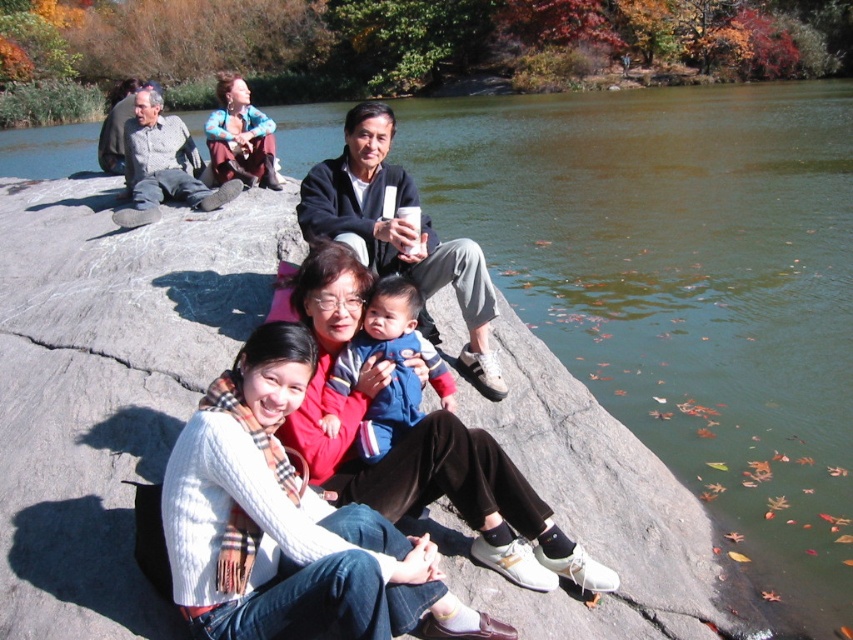
Question: Which object appears closest to the camera in this image?

Choices:
 (A) blue fleece jacket at center
 (B) white knit sweater at center
 (C) matte black jacket at center

Answer: (B)

Question: Does white knit sweater at center have a smaller size compared to matte black jacket at center?

Choices:
 (A) yes
 (B) no

Answer: (A)

Question: In this image, where is matte black jacket at center located relative to blue fleece jacket at center?

Choices:
 (A) below
 (B) above

Answer: (B)

Question: Which object appears farthest from the camera in this image?

Choices:
 (A) white knit sweater at center
 (B) matte black jacket at center

Answer: (B)

Question: Which object appears closest to the camera in this image?

Choices:
 (A) white knit sweater at center
 (B) blue fleece jacket at center
 (C) matte black jacket at center

Answer: (A)

Question: Is white knit sweater at center bigger than blue fleece jacket at center?

Choices:
 (A) yes
 (B) no

Answer: (A)